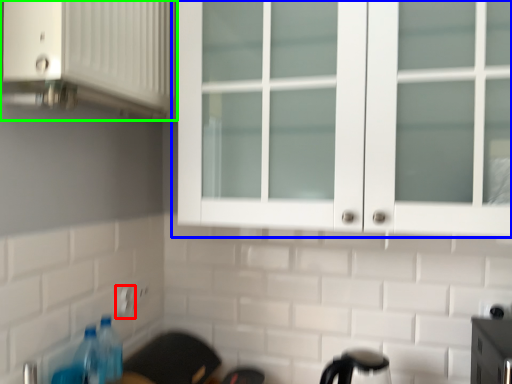
Question: Based on their relative distances, which object is nearer to electric outlet (highlighted by a red box)? Choose from cupboard (highlighted by a blue box) and cabinetry (highlighted by a green box).

Choices:
 (A) cupboard
 (B) cabinetry

Answer: (B)